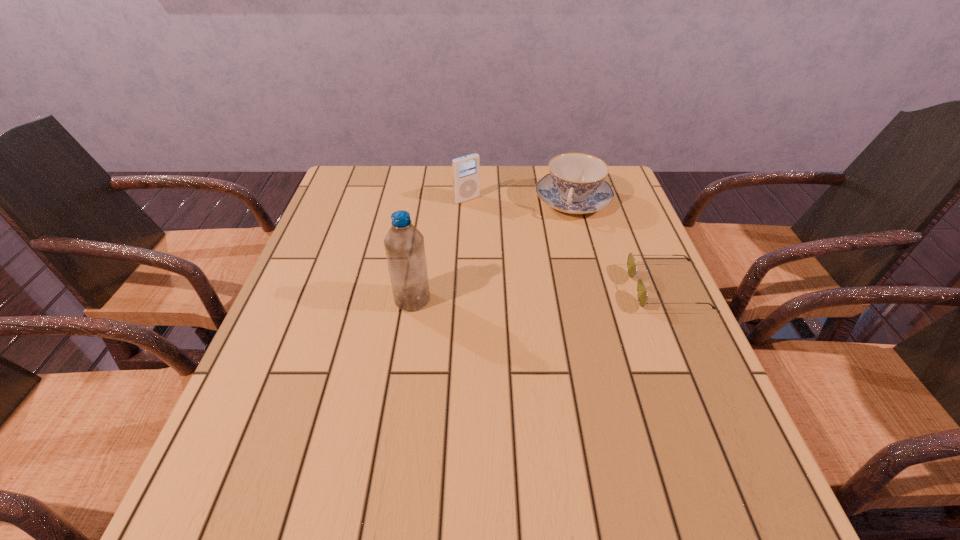
The height and width of the screenshot is (540, 960). Identify the location of vacant space on the desktop that is between the tallest object and the shortest object and is positioned with the handle on the side of the chinaware. (552, 294).

At what (x,y) coordinates should I click in order to perform the action: click on free space on the desktop that is between the water bottle and the shortest object and is positioned on the front-facing side of the third object from right to left. Please return your answer as a coordinate pair (x, y). The width and height of the screenshot is (960, 540). Looking at the image, I should click on (564, 293).